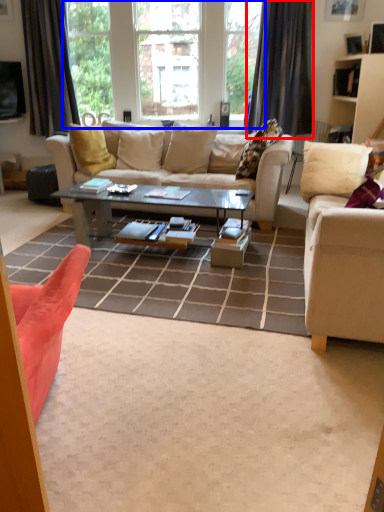
Question: Among these objects, which one is nearest to the camera, curtain (highlighted by a red box) or window (highlighted by a blue box)?

Choices:
 (A) curtain
 (B) window

Answer: (A)